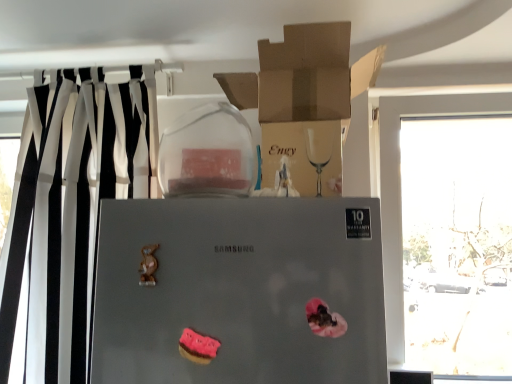
Question: From a real-world perspective, is pink frosted cookie at lower center positioned above or below brown cardboard box at upper center?

Choices:
 (A) above
 (B) below

Answer: (B)

Question: Based on their sizes in the image, would you say pink frosted cookie at lower center is bigger or smaller than brown cardboard box at upper center?

Choices:
 (A) small
 (B) big

Answer: (A)

Question: Which object is positioned farthest from the satin silver refrigerator at center?

Choices:
 (A) brown cardboard box at upper center
 (B) transparent glass window at right
 (C) pink frosted cookie at lower center
 (D) black/white striped curtain at left

Answer: (B)

Question: Estimate the real-world distances between objects in this image. Which object is closer to the brown cardboard box at upper center?

Choices:
 (A) pink frosted cookie at lower center
 (B) satin silver refrigerator at center
 (C) black/white striped curtain at left
 (D) transparent glass window at right

Answer: (B)